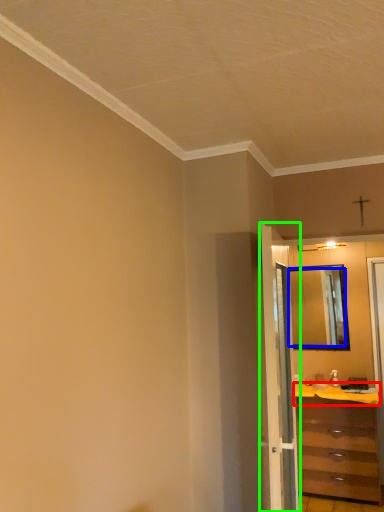
Question: Based on their relative distances, which object is farther from counter top (highlighted by a red box)? Choose from mirror (highlighted by a blue box) and door (highlighted by a green box).

Choices:
 (A) mirror
 (B) door

Answer: (B)